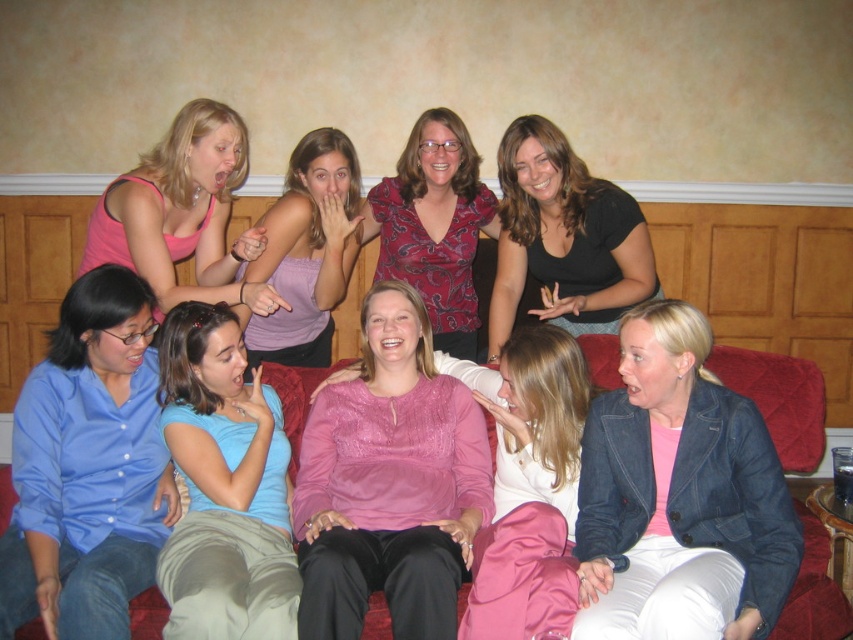
Does point (506, 624) lie behind point (248, 291)?

That is False.

Can you confirm if satin pink skirt at center is smaller than pink tank top at upper left?

Correct, satin pink skirt at center occupies less space than pink tank top at upper left.

At what (x,y) coordinates should I click in order to perform the action: click on satin pink skirt at center. Please return your answer as a coordinate pair (x, y). The image size is (853, 640). Looking at the image, I should click on (531, 488).

Where is `satin pink skirt at center`? The image size is (853, 640). satin pink skirt at center is located at coordinates click(531, 488).

Does light blue cotton shirt at lower left appear over red paisley blouse at center?

No.

Locate an element on the screen. light blue cotton shirt at lower left is located at coordinates (224, 486).

Looking at this image, is denim jacket at lower right positioned at the back of light blue cotton shirt at lower left?

No, it is not.

Does denim jacket at lower right appear under light blue cotton shirt at lower left?

Actually, denim jacket at lower right is above light blue cotton shirt at lower left.

What are the coordinates of `denim jacket at lower right` in the screenshot? It's located at (679, 497).